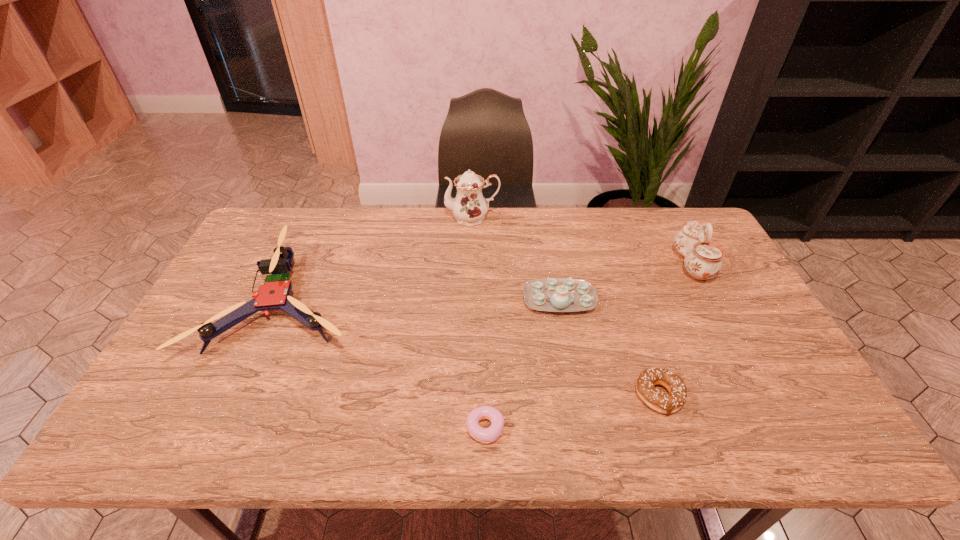
Select which chinaware is the third closest to the second object from right to left. Please provide its 2D coordinates. Your answer should be formatted as a tuple, i.e. [(x, y)], where the tuple contains the x and y coordinates of a point satisfying the conditions above.

[(469, 207)]

This screenshot has height=540, width=960. Find the location of `chinaware that can be found as the second closest to the tallest object`. chinaware that can be found as the second closest to the tallest object is located at coordinates (702, 260).

This screenshot has width=960, height=540. Identify the location of free space in the image that satisfies the following two spatial constraints: 1. on the front side of the shortest chinaware; 2. on the right side of the farthest chinaware. (470, 300).